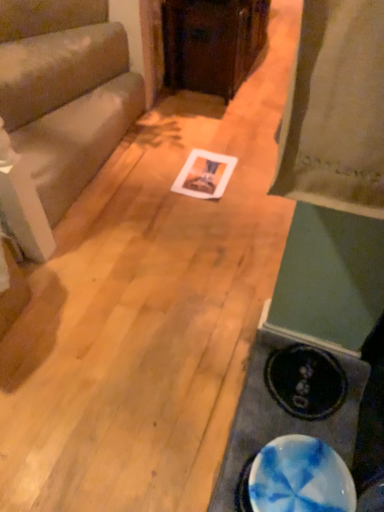
Question: Is blue marble table at lower right taller or shorter than blue marbled plate at lower right?

Choices:
 (A) short
 (B) tall

Answer: (A)

Question: Choose the correct answer: Is blue marble table at lower right inside blue marbled plate at lower right or outside it?

Choices:
 (A) outside
 (B) inside

Answer: (B)

Question: Estimate the real-world distances between objects in this image. Which object is closer to the wooden cabinet at center, the first furniture positioned from the top?

Choices:
 (A) matte gray couch at left, acting as the first furniture starting from the left
 (B) blue marbled plate at lower right
 (C) blue marble table at lower right

Answer: (A)

Question: Which is farther from the blue marbled plate at lower right?

Choices:
 (A) matte gray couch at left, which ranks as the second furniture in right-to-left order
 (B) wooden cabinet at center, the first furniture positioned from the top
 (C) blue marble table at lower right

Answer: (B)